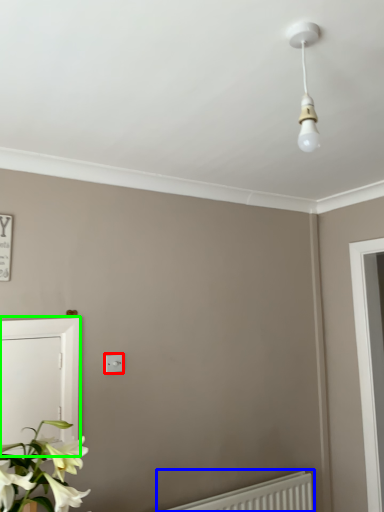
Question: Which is nearer to the light switch (highlighted by a red box)? radiator (highlighted by a blue box) or screen door (highlighted by a green box).

Choices:
 (A) radiator
 (B) screen door

Answer: (B)